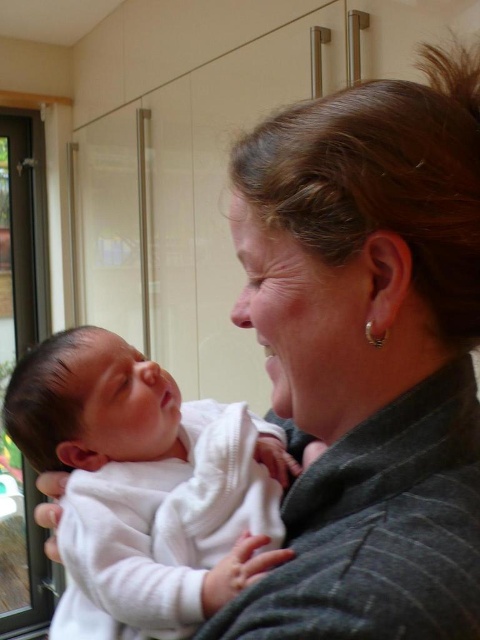
In the scene shown: Who is lower down, white soft baby at center or transparent glass screen door at left?

white soft baby at center is below.

At what (x,y) coordinates should I click in order to perform the action: click on white soft baby at center. Please return your answer as a coordinate pair (x, y). Looking at the image, I should click on (144, 484).